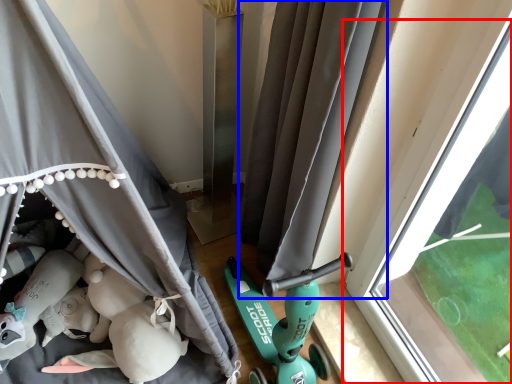
Question: Which of the following is the farthest to the observer, window (highlighted by a red box) or curtain (highlighted by a blue box)?

Choices:
 (A) window
 (B) curtain

Answer: (B)